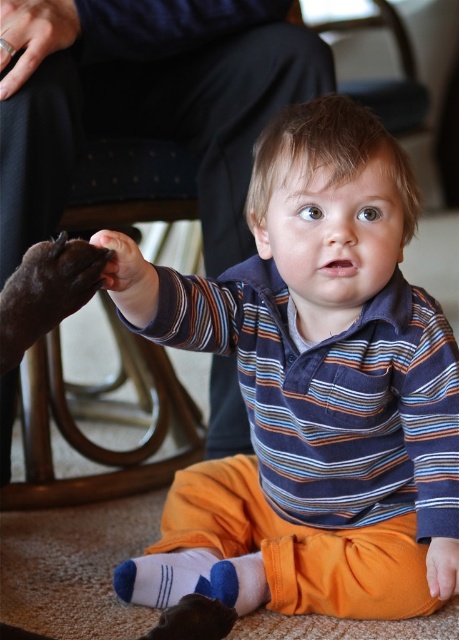
Does white soft sock at lower center have a lesser height compared to matte black paw at center?

Incorrect, white soft sock at lower center's height does not fall short of matte black paw at center's.

Find the location of `white soft sock at lower center`. white soft sock at lower center is located at coordinates (192, 579).

Where is `white soft sock at lower center`? This screenshot has width=459, height=640. white soft sock at lower center is located at coordinates (192, 579).

Is black fur paw at left closer to the viewer compared to orange fabric foot at lower right?

Yes, black fur paw at left is in front of orange fabric foot at lower right.

Is black fur paw at left to the left of orange fabric foot at lower right from the viewer's perspective?

Correct, you'll find black fur paw at left to the left of orange fabric foot at lower right.

This screenshot has width=459, height=640. I want to click on black fur paw at left, so click(x=46, y=292).

Between black fur paw at left and metallic ring at upper left, which one appears on the left side from the viewer's perspective?

Positioned to the left is metallic ring at upper left.

Does black fur paw at left have a lesser width compared to metallic ring at upper left?

No.

Is point (61, 260) positioned after point (28, 4)?

No, it is not.

The width and height of the screenshot is (459, 640). Find the location of `black fur paw at left`. black fur paw at left is located at coordinates (46, 292).